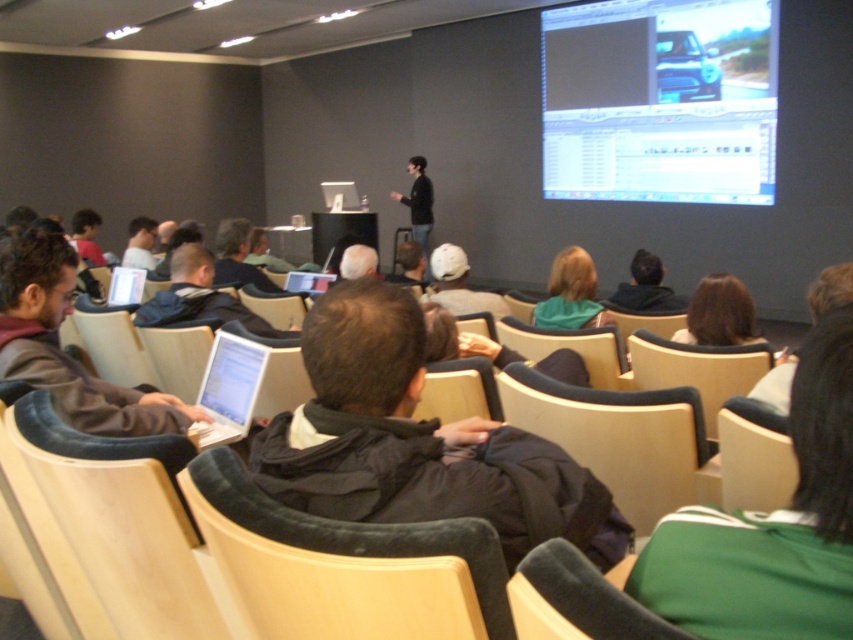
Question: Is matte brown jacket at left to the left of light wood chair at lower right from the viewer's perspective?

Choices:
 (A) no
 (B) yes

Answer: (B)

Question: Considering the real-world distances, which object is closest to the dark gray jacket at center?

Choices:
 (A) dark fabric chair at center
 (B) matte black car at upper center
 (C) green fabric jacket at lower right

Answer: (C)

Question: Is matte black car at upper center to the right of dark fabric chair at center from the viewer's perspective?

Choices:
 (A) yes
 (B) no

Answer: (A)

Question: Is the position of matte black car at upper center less distant than that of dark fabric chair at center?

Choices:
 (A) yes
 (B) no

Answer: (B)

Question: Estimate the real-world distances between objects in this image. Which object is closer to the beige fabric chair at lower right?

Choices:
 (A) green fabric jacket at center
 (B) dark brown hair at center

Answer: (B)

Question: Which point appears closest to the camera in this image?

Choices:
 (A) (697, 528)
 (B) (474, 298)

Answer: (A)